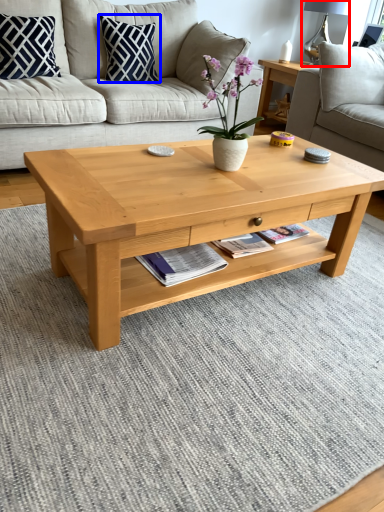
Question: Which object appears closest to the camera in this image, lamp (highlighted by a red box) or pillow (highlighted by a blue box)?

Choices:
 (A) lamp
 (B) pillow

Answer: (B)